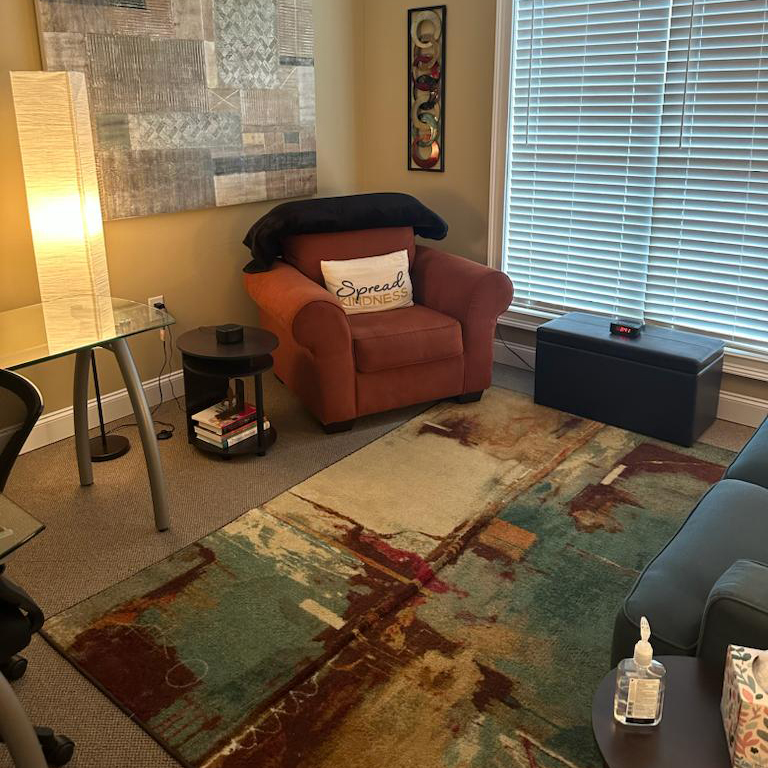
The height and width of the screenshot is (768, 768). In order to click on blanket in this screenshot , I will do `click(365, 213)`.